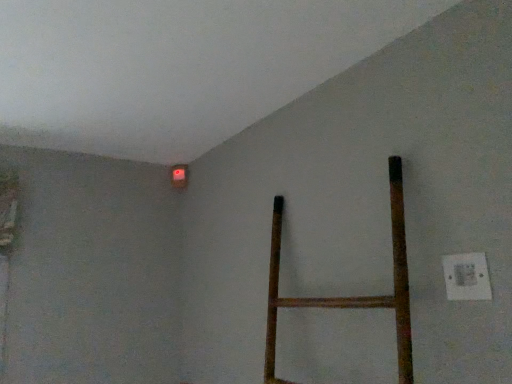
This screenshot has width=512, height=384. What do you see at coordinates (179, 176) in the screenshot?
I see `matte orange light at upper left` at bounding box center [179, 176].

At what (x,y) coordinates should I click in order to perform the action: click on matte orange light at upper left. Please return your answer as a coordinate pair (x, y). Looking at the image, I should click on click(x=179, y=176).

Measure the distance between matte orange light at upper left and camera.

matte orange light at upper left is 5.79 feet away from camera.

Measure the distance between white plastic electric outlet at lower right and camera.

white plastic electric outlet at lower right is 76.63 centimeters from camera.

Describe the element at coordinates (466, 277) in the screenshot. Image resolution: width=512 pixels, height=384 pixels. I see `white plastic electric outlet at lower right` at that location.

Find the location of a particular element. The image size is (512, 384). white plastic electric outlet at lower right is located at coordinates (466, 277).

Locate an element on the screen. This screenshot has width=512, height=384. matte orange light at upper left is located at coordinates (179, 176).

Based on the photo, between white plastic electric outlet at lower right and matte orange light at upper left, which one appears on the right side from the viewer's perspective?

white plastic electric outlet at lower right.

Does white plastic electric outlet at lower right come behind matte orange light at upper left?

No.

Is point (460, 280) behind point (176, 174)?

That is False.

From the image's perspective, who appears lower, white plastic electric outlet at lower right or matte orange light at upper left?

white plastic electric outlet at lower right.

From a real-world perspective, is white plastic electric outlet at lower right over matte orange light at upper left?

No, from a real-world perspective, white plastic electric outlet at lower right is not on top of matte orange light at upper left.

Does white plastic electric outlet at lower right have a greater width compared to matte orange light at upper left?

No, white plastic electric outlet at lower right is not wider than matte orange light at upper left.

Who is shorter, white plastic electric outlet at lower right or matte orange light at upper left?

white plastic electric outlet at lower right.

Can you confirm if white plastic electric outlet at lower right is smaller than matte orange light at upper left?

Yes, white plastic electric outlet at lower right is smaller than matte orange light at upper left.

Is matte orange light at upper left located within white plastic electric outlet at lower right?

Actually, matte orange light at upper left is outside white plastic electric outlet at lower right.

Is white plastic electric outlet at lower right beside matte orange light at upper left?

white plastic electric outlet at lower right and matte orange light at upper left are not in contact.

Is white plastic electric outlet at lower right oriented towards matte orange light at upper left?

No, white plastic electric outlet at lower right is not facing towards matte orange light at upper left.

How different are the orientations of white plastic electric outlet at lower right and matte orange light at upper left in degrees?

0.0105 degrees.

How far apart are white plastic electric outlet at lower right and matte orange light at upper left?

They are 1.21 meters apart.

You are a GUI agent. You are given a task and a screenshot of the screen. Output one action in this format:
    pyautogui.click(x=<x>, y=<y>)
    Task: Click on the lamp behind the white plastic electric outlet at lower right
    
    Given the screenshot: What is the action you would take?
    pyautogui.click(x=179, y=176)

Can you confirm if matte orange light at upper left is positioned to the right of white plastic electric outlet at lower right?

In fact, matte orange light at upper left is to the left of white plastic electric outlet at lower right.

Is matte orange light at upper left in front of or behind white plastic electric outlet at lower right in the image?

In the image, matte orange light at upper left appears behind white plastic electric outlet at lower right.

Considering the positions of point (177, 183) and point (485, 276), is point (177, 183) closer or farther from the camera than point (485, 276)?

Point (177, 183) appears to be farther away from the viewer than point (485, 276).

From the image's perspective, which is below, matte orange light at upper left or white plastic electric outlet at lower right?

white plastic electric outlet at lower right appears lower in the image.

From a real-world perspective, which is physically below, matte orange light at upper left or white plastic electric outlet at lower right?

In real-world perspective, white plastic electric outlet at lower right is lower.

Which of these two, matte orange light at upper left or white plastic electric outlet at lower right, is wider?

matte orange light at upper left is wider.

Can you confirm if matte orange light at upper left is shorter than white plastic electric outlet at lower right?

No.

Considering the sizes of matte orange light at upper left and white plastic electric outlet at lower right in the image, is matte orange light at upper left bigger or smaller than white plastic electric outlet at lower right?

In the image, matte orange light at upper left appears to be larger than white plastic electric outlet at lower right.

Which is correct: matte orange light at upper left is inside white plastic electric outlet at lower right, or outside of it?

matte orange light at upper left is outside white plastic electric outlet at lower right.

Is matte orange light at upper left with white plastic electric outlet at lower right?

There is a gap between matte orange light at upper left and white plastic electric outlet at lower right.

Is matte orange light at upper left oriented towards white plastic electric outlet at lower right?

No, matte orange light at upper left is not facing towards white plastic electric outlet at lower right.

What's the angular difference between matte orange light at upper left and white plastic electric outlet at lower right's facing directions?

The facing directions of matte orange light at upper left and white plastic electric outlet at lower right are 0.0105 degrees apart.

Find the location of a particular element. This screenshot has height=384, width=512. lamp above the white plastic electric outlet at lower right (from a real-world perspective) is located at coordinates (179, 176).

Identify the location of lamp above the white plastic electric outlet at lower right (from the image's perspective). (179, 176).

This screenshot has width=512, height=384. Find the location of `lamp that appears behind the white plastic electric outlet at lower right`. lamp that appears behind the white plastic electric outlet at lower right is located at coordinates pyautogui.click(x=179, y=176).